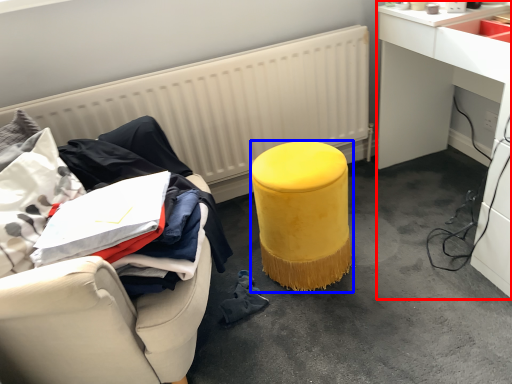
Question: Which point is closer to the camera, desk (highlighted by a red box) or stool (highlighted by a blue box)?

Choices:
 (A) desk
 (B) stool

Answer: (A)